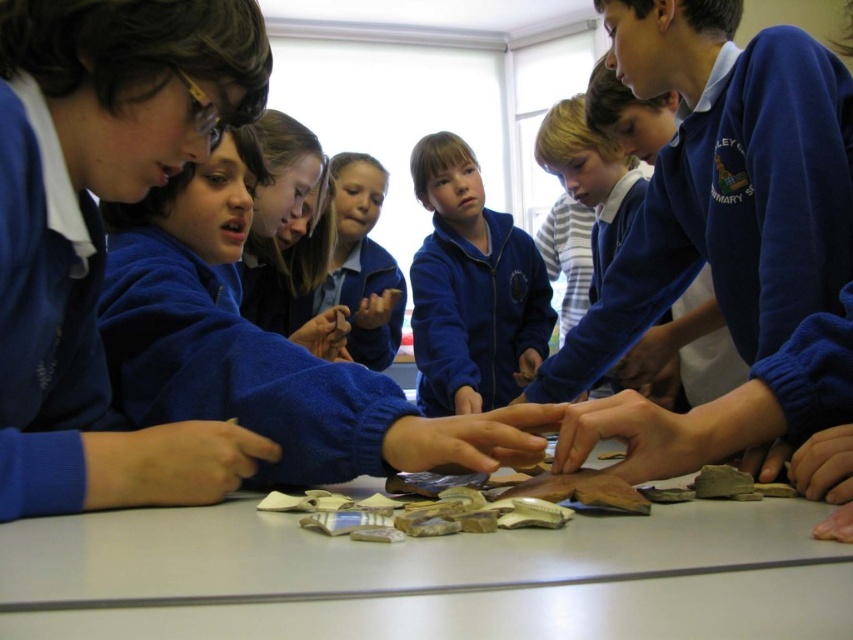
You are a tailor measuring the children for new uniforms. You notice the matte blue jacket at center and the matte blue uniform at center. Which one has a wider torso measurement?

The matte blue jacket at center has a wider torso measurement than the matte blue uniform at center, as the jacket is described to be larger in width than the uniform.

You are a teacher observing the children around the table. You notice two points marked on the table where the children are focusing their attention. Which point is closer to you, point (463, 184) or point (698, 362)?

Point (463, 184) is further to the viewer than point (698, 362), so the point closer to you is point (698, 362).